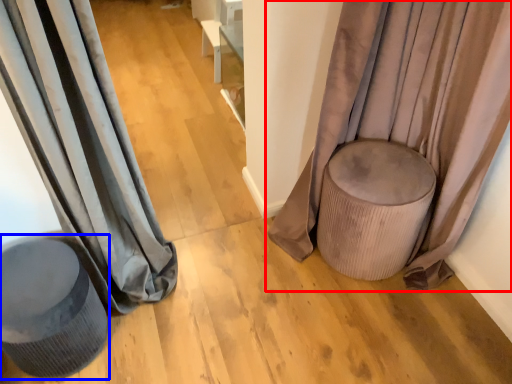
Question: Which object is closer to the camera taking this photo, curtain (highlighted by a red box) or swivel chair (highlighted by a blue box)?

Choices:
 (A) curtain
 (B) swivel chair

Answer: (A)